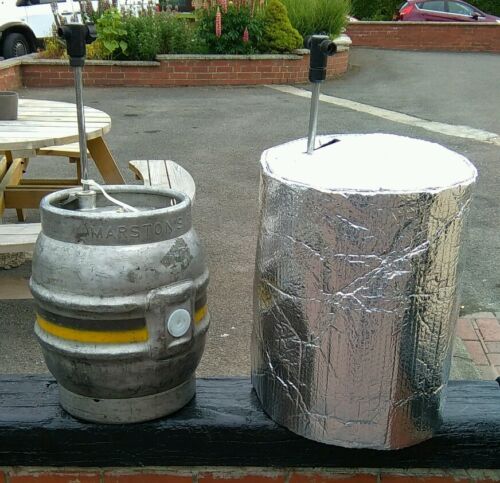
The height and width of the screenshot is (483, 500). Find the location of `painted black wood top`. painted black wood top is located at coordinates (226, 426).